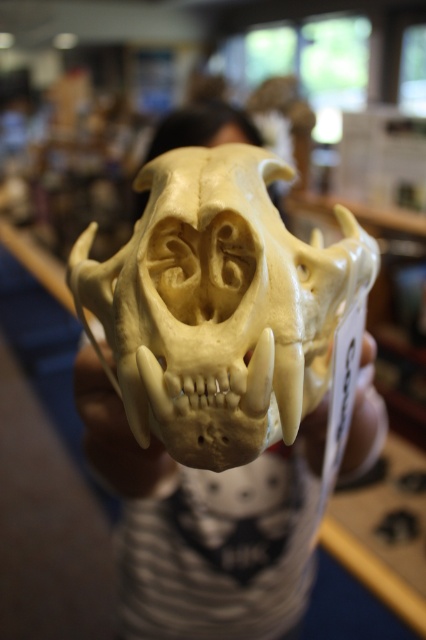
You are a museum curator preparing an exhibit. You have an ivory bone skull at center and a white bone hand at center. Which object would require a larger display case to accommodate its size?

The ivory bone skull at center requires a larger display case because it has a larger size compared to the white bone hand at center.

You are a museum curator arranging an exhibit. You have two skulls displayed at the center of the display area. The ivory bone skull at center and the white bone skull at center. You need to place a label indicating their sizes. Which label should you place under which skull?

The ivory bone skull at center is bigger than the white bone skull at center, so the label indicating larger size should be placed under the ivory bone skull at center, while the smaller size label goes under the white bone skull at center.

You are a museum curator arranging an exhibit. You have an ivory bone skull at center and a white bone skull at center. If you want to ensure visitors can see both skulls clearly, which one should be placed closer to the front?

The ivory bone skull at center is already positioned in front of the white bone skull at center, so to maintain visibility for both, the ivory bone skull at center should remain closer to the front while ensuring the white bone skull at center is placed slightly behind but still visible.